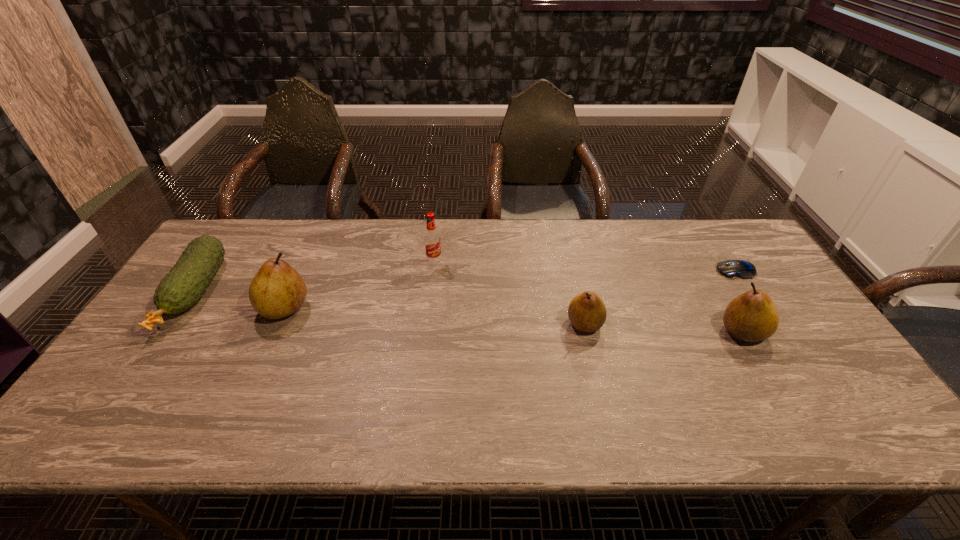
Locate an element on the screen. This screenshot has width=960, height=540. pear present at the right edge is located at coordinates (752, 316).

Locate an element on the screen. This screenshot has width=960, height=540. computer mouse located at the right edge is located at coordinates (742, 269).

Image resolution: width=960 pixels, height=540 pixels. In order to click on object that is at the far left corner in this screenshot , I will do `click(182, 287)`.

The image size is (960, 540). I want to click on object that is at the far right corner, so click(742, 269).

The width and height of the screenshot is (960, 540). In the image, there is a desktop. Identify the location of vacant space at the far edge. (493, 258).

In the image, there is a desktop. Where is `vacant space at the near edge`? The height and width of the screenshot is (540, 960). vacant space at the near edge is located at coordinates (255, 396).

Find the location of a particular element. Image resolution: width=960 pixels, height=540 pixels. free space at the left edge of the desktop is located at coordinates (147, 342).

You are a GUI agent. You are given a task and a screenshot of the screen. Output one action in this format:
    pyautogui.click(x=<x>, y=<y>)
    Task: Click on the free spot at the right edge of the desktop
    
    Given the screenshot: What is the action you would take?
    tap(785, 326)

At what (x,y) coordinates should I click in order to perform the action: click on vacant space at the far left corner. Please return your answer as a coordinate pair (x, y). Looking at the image, I should click on (251, 259).

Where is `free spot at the near left corner of the desktop`? free spot at the near left corner of the desktop is located at coordinates (111, 387).